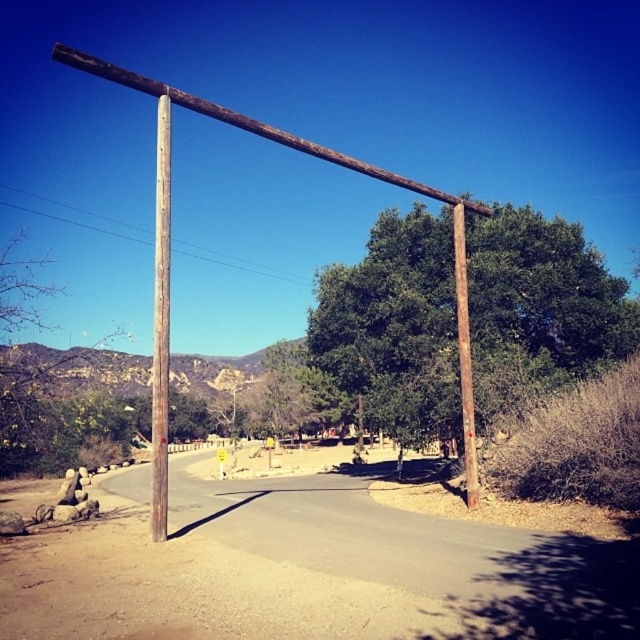
Who is higher up, brown rough wooden pole at upper center or brown wooden pole at left?

brown rough wooden pole at upper center is higher up.

How distant is brown rough wooden pole at upper center from brown wooden pole at left?

brown rough wooden pole at upper center is 32.43 feet away from brown wooden pole at left.

Find the location of a particular element. This screenshot has width=640, height=640. brown rough wooden pole at upper center is located at coordinates (244, 122).

Can you confirm if brown rough wooden pole at upper center is shorter than brown rough wooden pole at right?

No, brown rough wooden pole at upper center is not shorter than brown rough wooden pole at right.

Identify the location of brown rough wooden pole at upper center. (244, 122).

Find the location of a particular element. brown rough wooden pole at upper center is located at coordinates (244, 122).

Does brown wooden pole at left appear on the right side of brown rough wooden pole at right?

No, brown wooden pole at left is not to the right of brown rough wooden pole at right.

Can you confirm if brown wooden pole at left is wider than brown rough wooden pole at right?

Correct, the width of brown wooden pole at left exceeds that of brown rough wooden pole at right.

Is point (161, 195) less distant than point (461, 392)?

Yes, point (161, 195) is closer to viewer.

Where is `brown wooden pole at left`? brown wooden pole at left is located at coordinates click(x=161, y=323).